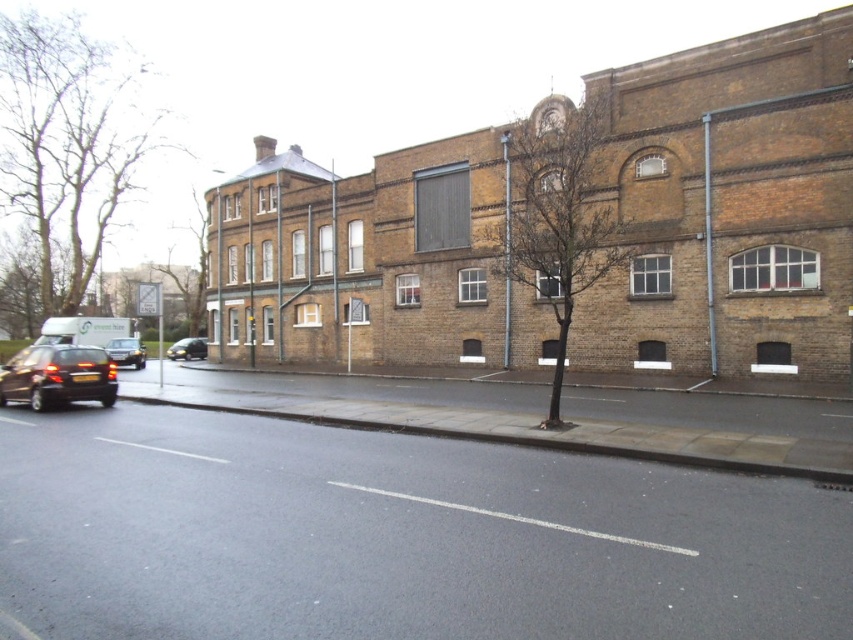
Question: Among these objects, which one is nearest to the camera?

Choices:
 (A) shiny black car at lower left
 (B) shiny black car at left

Answer: (A)

Question: Which point is closer to the camera?

Choices:
 (A) shiny black car at center-left
 (B) shiny black car at left

Answer: (B)

Question: Which point is farther from the camera taking this photo?

Choices:
 (A) (112, 365)
 (B) (187, 337)
 (C) (148, 282)
 (D) (115, 339)

Answer: (C)

Question: Does white plastic street sign at upper center appear on the left side of shiny black car at center-left?

Choices:
 (A) no
 (B) yes

Answer: (B)

Question: Is shiny black car at left smaller than shiny black car at center-left?

Choices:
 (A) yes
 (B) no

Answer: (A)

Question: Is shiny black car at left positioned before shiny black car at center-left?

Choices:
 (A) no
 (B) yes

Answer: (B)